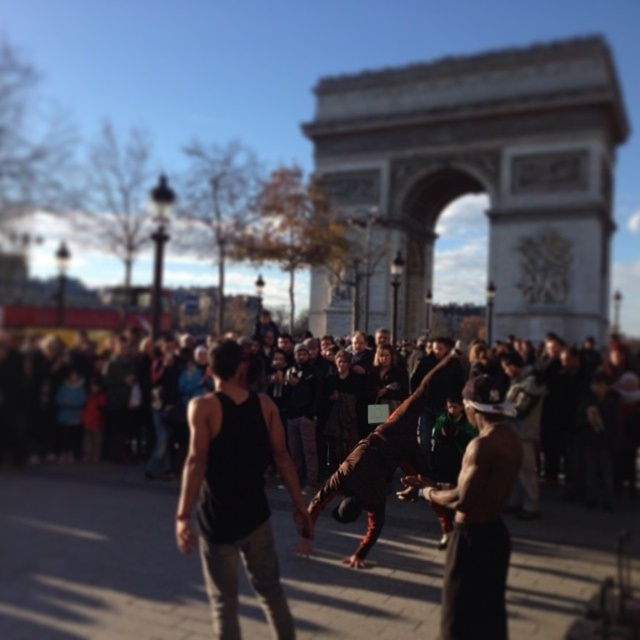
You are a photographer standing in front of the Arc de Triomphe. You see a shiny metallic helmet at center and a brown leather jacket at center. Which object is closer to the camera?

The shiny metallic helmet at center is positioned over the brown leather jacket at center, so it is closer to the camera.

You are standing at the center of the street scene in front of the Arc de Triomphe. You see a dark brown leather jacket at center. Where is the dark brown leather jacket located relative to the point with coordinates point [90,396]?

The dark brown leather jacket at center is located exactly at the point with coordinates point [90,396].